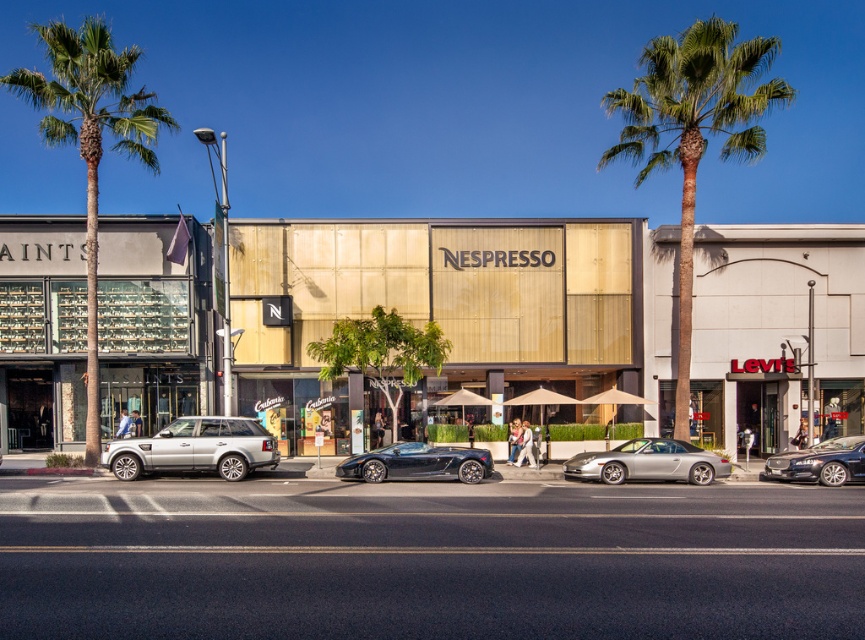
The image size is (865, 640). What do you see at coordinates (648, 461) in the screenshot?
I see `silver metallic convertible at center` at bounding box center [648, 461].

Does silver metallic convertible at center lie in front of shiny black sedan at right?

No, silver metallic convertible at center is further to the viewer.

Which is in front, point (609, 465) or point (804, 454)?

Point (609, 465)

Locate an element on the screen. The width and height of the screenshot is (865, 640). silver metallic convertible at center is located at coordinates (648, 461).

In the scene shown: Can you confirm if gold metallic building at center is positioned above gold textured building at center?

Incorrect, gold metallic building at center is not positioned above gold textured building at center.

Is gold metallic building at center thinner than gold textured building at center?

In fact, gold metallic building at center might be wider than gold textured building at center.

The width and height of the screenshot is (865, 640). Identify the location of gold metallic building at center. (455, 310).

This screenshot has height=640, width=865. Identify the location of gold metallic building at center. (455, 310).

Can you confirm if gold metallic building at center is positioned above green leafy palm tree at left?

Actually, gold metallic building at center is below green leafy palm tree at left.

Is gold metallic building at center taller than green leafy palm tree at left?

In fact, gold metallic building at center may be shorter than green leafy palm tree at left.

The image size is (865, 640). What are the coordinates of `gold metallic building at center` in the screenshot? It's located at (455, 310).